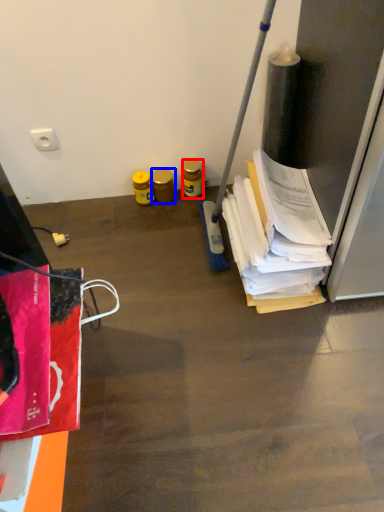
Question: Which object appears closest to the camera in this image, bottle (highlighted by a red box) or bottle (highlighted by a blue box)?

Choices:
 (A) bottle
 (B) bottle

Answer: (A)